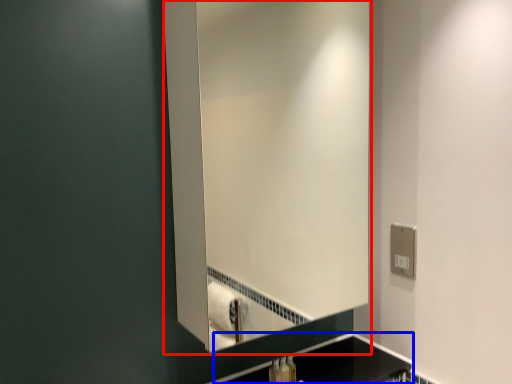
Question: Which object is closer to the camera taking this photo, mirror (highlighted by a red box) or counter top (highlighted by a blue box)?

Choices:
 (A) mirror
 (B) counter top

Answer: (A)